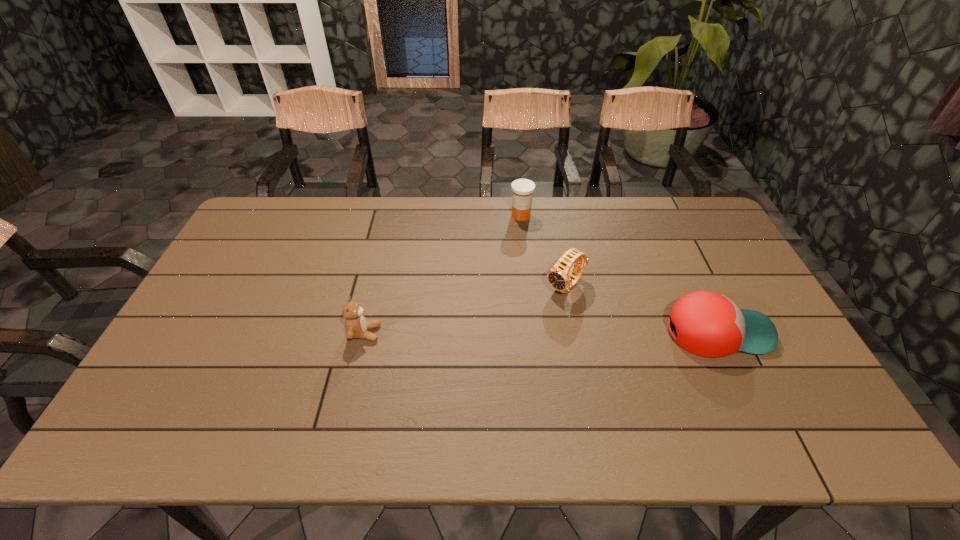
Where is `vacant space situated 0.110m on the label of the medicine`? vacant space situated 0.110m on the label of the medicine is located at coordinates (530, 242).

Locate an element on the screen. free location located on the label of the medicine is located at coordinates (535, 254).

I want to click on vacant area situated 0.240m on the label of the medicine, so [540, 269].

Find the location of `object that is at the far edge`. object that is at the far edge is located at coordinates (523, 189).

Locate an element on the screen. object at the right edge is located at coordinates (708, 324).

I want to click on vacant space at the far edge of the desktop, so click(x=325, y=227).

Image resolution: width=960 pixels, height=540 pixels. Find the location of `vacant space at the near edge of the desktop`. vacant space at the near edge of the desktop is located at coordinates (671, 393).

This screenshot has height=540, width=960. In order to click on vacant space at the left edge in this screenshot , I will do `click(236, 330)`.

Identify the location of free region at the right edge of the desktop. The width and height of the screenshot is (960, 540). (771, 372).

The image size is (960, 540). Find the location of `vacant space at the far left corner of the desktop`. vacant space at the far left corner of the desktop is located at coordinates (293, 218).